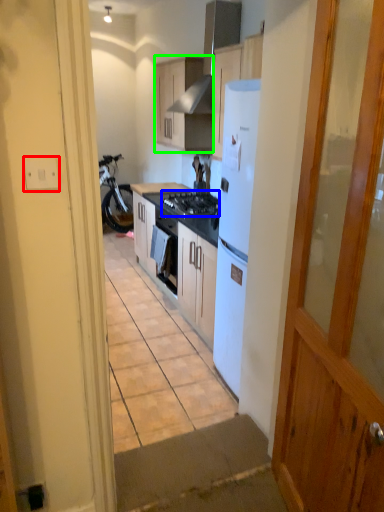
Question: Estimate the real-world distances between objects in this image. Which object is closer to electric outlet (highlighted by a red box), gas stove (highlighted by a blue box) or cabinetry (highlighted by a green box)?

Choices:
 (A) gas stove
 (B) cabinetry

Answer: (A)